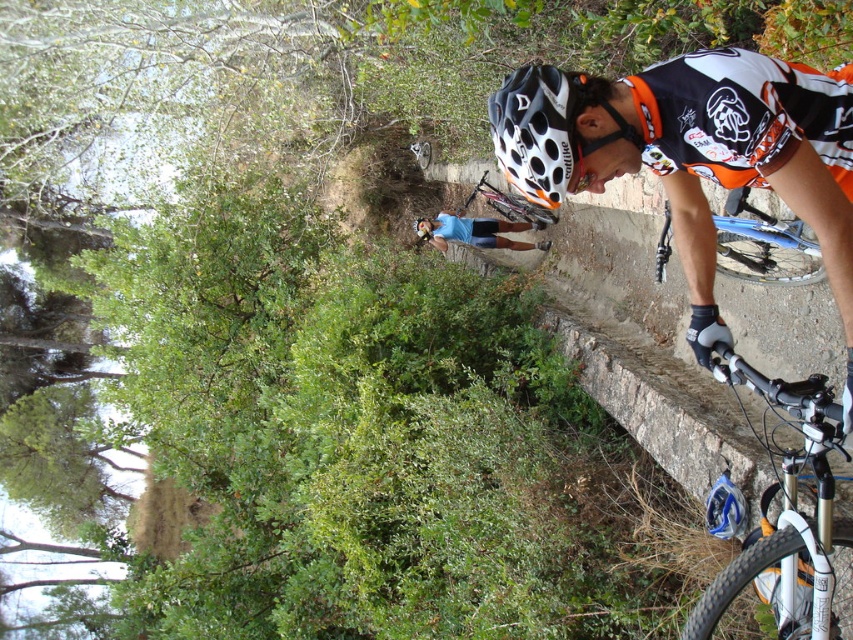
What object is located at the coordinates point (537, 131)?

The point (537, 131) corresponds to the white dotted plastic helmet at center.

You are a photographer trying to capture a photo of the white dotted plastic helmet at center and the blue metallic bicycle at right. Based on their positions, which object should you focus on first to ensure both are in frame?

The white dotted plastic helmet at center is positioned over the blue metallic bicycle at right, so focusing on the helmet first will ensure both are in frame as the bicycle is below it.